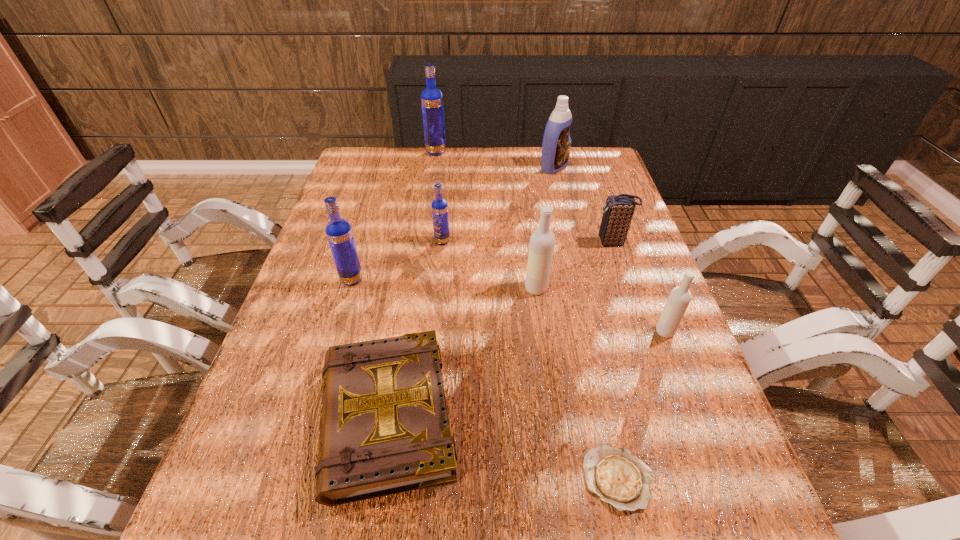
You are a GUI agent. You are given a task and a screenshot of the screen. Output one action in this format:
    pyautogui.click(x=<x>, y=<y>)
    Task: Click on the right white vodka
    The height and width of the screenshot is (540, 960).
    Given the screenshot: What is the action you would take?
    pyautogui.click(x=679, y=298)

At what (x,y) coordinates should I click in order to perform the action: click on the nearest vodka. Please return your answer as a coordinate pair (x, y). Image resolution: width=960 pixels, height=540 pixels. Looking at the image, I should click on (679, 298).

In order to click on clutch bag in this screenshot , I will do `click(618, 210)`.

Where is `brown hardback book`? The image size is (960, 540). brown hardback book is located at coordinates (384, 428).

At what (x,y) coordinates should I click in order to perform the action: click on hardback book. Please return your answer as a coordinate pair (x, y). Image resolution: width=960 pixels, height=540 pixels. Looking at the image, I should click on (384, 428).

I want to click on brown quiche, so click(x=618, y=477).

The image size is (960, 540). Identify the location of the shortest object. (618, 477).

The image size is (960, 540). I want to click on vacant space located 0.380m on the front of the farthest vodka, so click(x=425, y=222).

Image resolution: width=960 pixels, height=540 pixels. What are the coordinates of `free region located 0.230m on the left of the second farthest object` in the screenshot? It's located at (471, 167).

Locate an element on the screen. The image size is (960, 540). vacant space located on the back of the leftmost blue vodka is located at coordinates (365, 235).